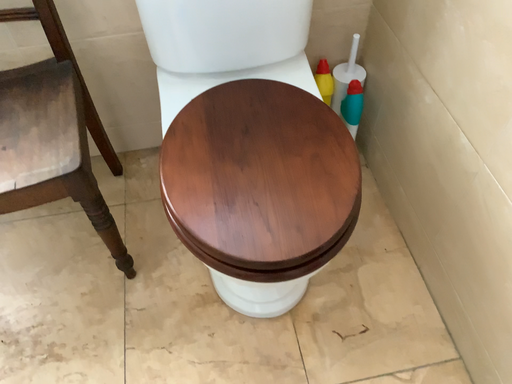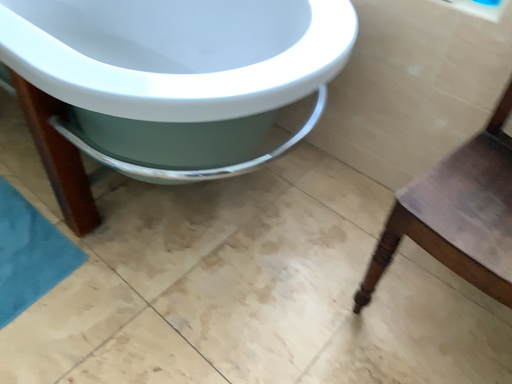
Question: Which way did the camera rotate in the video?

Choices:
 (A) rotated right
 (B) rotated left

Answer: (B)